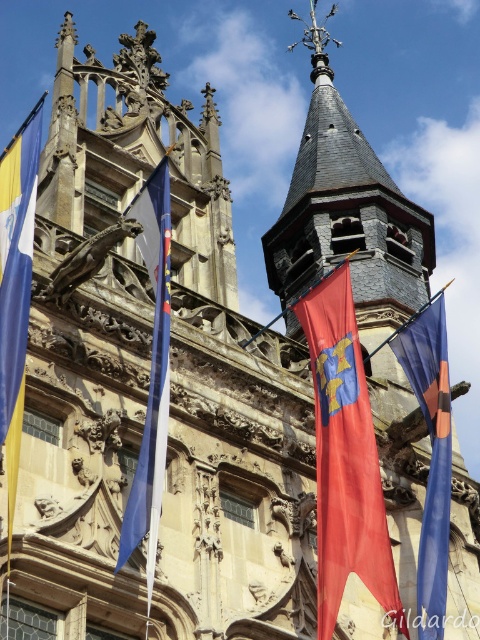
Consider the image. You are standing at the entrance of the historic building and want to take a photo of the blue fabric flag at right. Considering the distance, would you need a zoom lens to capture it clearly?

The blue fabric flag at right is 168.36 feet away from the camera. A zoom lens would be necessary to capture it clearly from that distance.

You are a flag installer who needs to replace both flags. You have a ladder that can reach up to 40 feet. Considering the distance between the red fabric flag at center and the yellowmatteflag at left, can you safely move from one flag to the other using your ladder?

The red fabric flag at center and yellowmatteflag at left are 46.72 feet apart. Since your ladder can only reach up to 40 feet, you cannot safely move between them as the distance exceeds the ladder capacity.

You are a visitor standing in front of the historic building and see the blue fabric flag at right and the blue fabric flag at center. Which flag is larger in size?

The blue fabric flag at right is bigger than the blue fabric flag at center.